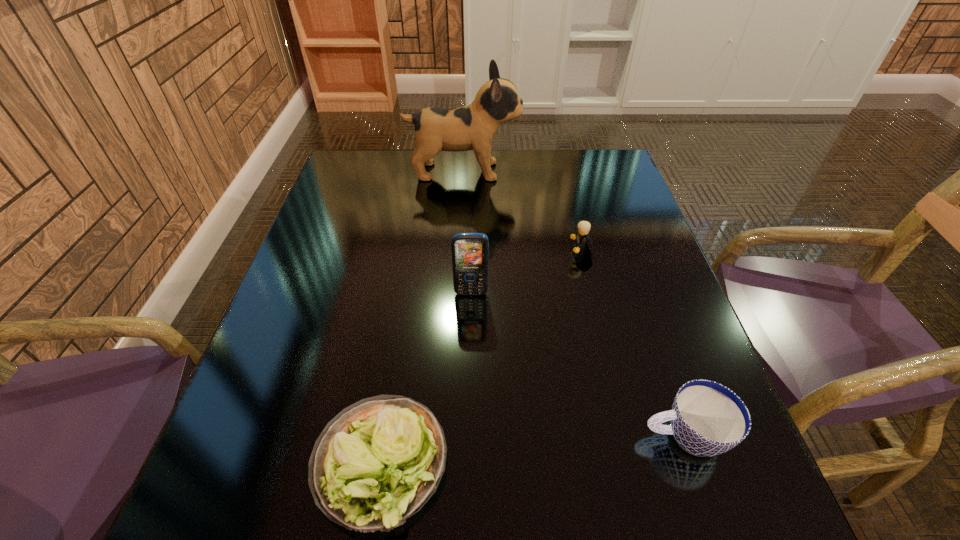
I want to click on vacant space situated 0.370m on the front-facing side of the second farthest object, so click(x=418, y=251).

Locate an element on the screen. The image size is (960, 540). free location located on the front-facing side of the second farthest object is located at coordinates (446, 251).

In order to click on vacant space situated 0.130m on the side of the cup with the handle in this screenshot , I will do `click(564, 436)`.

The image size is (960, 540). I want to click on vacant space located on the side of the cup with the handle, so click(486, 436).

The height and width of the screenshot is (540, 960). Identify the location of free location located on the side of the cup with the handle. (498, 436).

At what (x,y) coordinates should I click in order to perform the action: click on vacant space situated 0.370m on the back of the lettuce. Please return your answer as a coordinate pair (x, y). The height and width of the screenshot is (540, 960). Looking at the image, I should click on (413, 260).

You are a GUI agent. You are given a task and a screenshot of the screen. Output one action in this format:
    pyautogui.click(x=<x>, y=<y>)
    Task: Click on the object at the far edge
    This screenshot has width=960, height=540.
    Given the screenshot: What is the action you would take?
    pyautogui.click(x=473, y=127)

The height and width of the screenshot is (540, 960). What are the coordinates of `object that is at the near edge` in the screenshot? It's located at (376, 463).

Locate an element on the screen. This screenshot has width=960, height=540. object located in the left edge section of the desktop is located at coordinates (376, 463).

Find the location of a particular element. Lego positioned at the right edge is located at coordinates (581, 236).